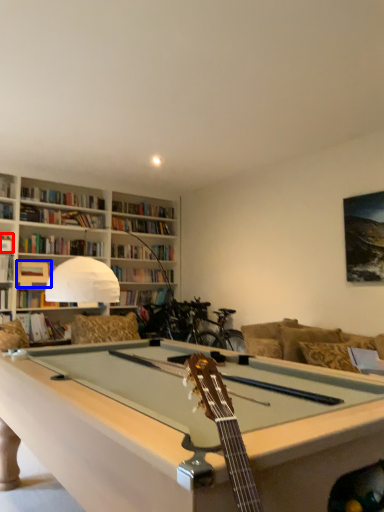
Question: Among these objects, which one is farthest to the camera, book (highlighted by a red box) or book (highlighted by a blue box)?

Choices:
 (A) book
 (B) book

Answer: (B)